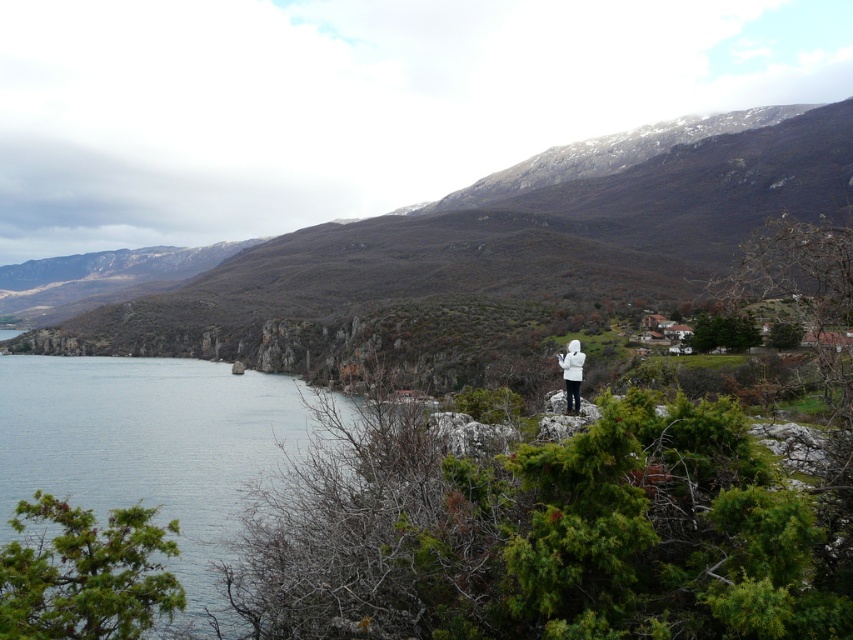
In the scene shown: Can you confirm if rocky brown mountain at center is smaller than blue water at lower left?

No, rocky brown mountain at center is not smaller than blue water at lower left.

Can you confirm if rocky brown mountain at center is positioned below blue water at lower left?

Incorrect, rocky brown mountain at center is not positioned below blue water at lower left.

Who is more distant from viewer, (761, 138) or (248, 470)?

Point (761, 138)

Where is `rocky brown mountain at center`? rocky brown mountain at center is located at coordinates (485, 260).

Can you confirm if rocky brown mountain at center is positioned below white matte jacket at center?

No.

Consider the image. Who is higher up, rocky brown mountain at center or white matte jacket at center?

rocky brown mountain at center is above.

Is point (509, 221) positioned behind point (567, 400)?

Yes.

Where is `rocky brown mountain at center`? The image size is (853, 640). rocky brown mountain at center is located at coordinates (485, 260).

Does blue water at lower left appear over white matte jacket at center?

Actually, blue water at lower left is below white matte jacket at center.

Who is lower down, blue water at lower left or white matte jacket at center?

blue water at lower left is below.

Is point (68, 378) positioned in front of point (572, 385)?

No, (68, 378) is further to viewer.

The image size is (853, 640). What are the coordinates of `blue water at lower left` in the screenshot? It's located at (148, 444).